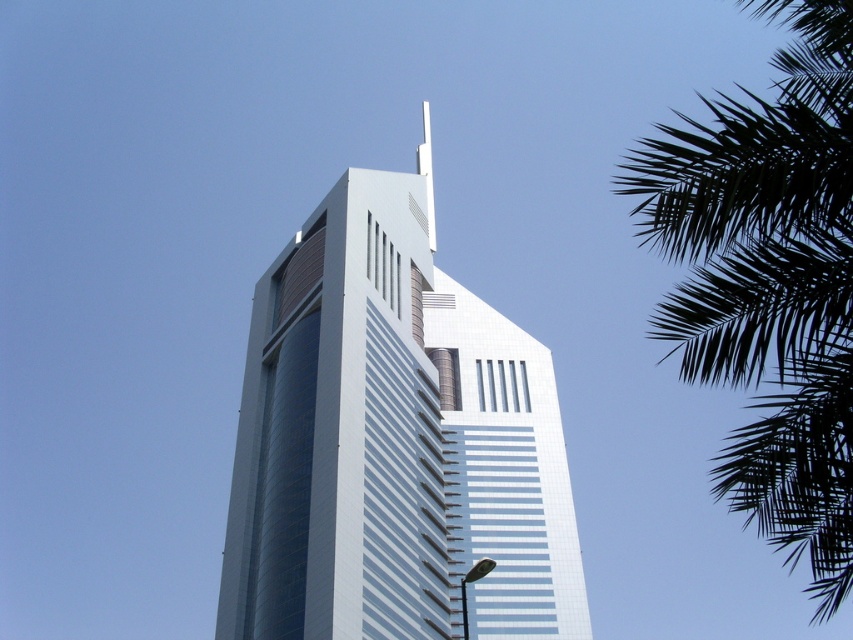
You are standing in front of the white glass building at center and want to take a photo of the green leafy palm at upper right. Which direction should you turn to face the palm?

You should turn to your right to face the green leafy palm at upper right because the white glass building at center is to the left of the palm.

You are standing at the center of the image and want to walk towards the white glass building at center. In which direction should you go?

Since the white glass building at center is already at the center of the image, you are already facing it directly. There is no need to change direction.

You are an architect evaluating the skyscraper design. From your observation point, which object appears taller between the white glass building at center and the green leafy palm at upper right?

The green leafy palm at upper right appears taller than the white glass building at center based on their relative heights in the image.